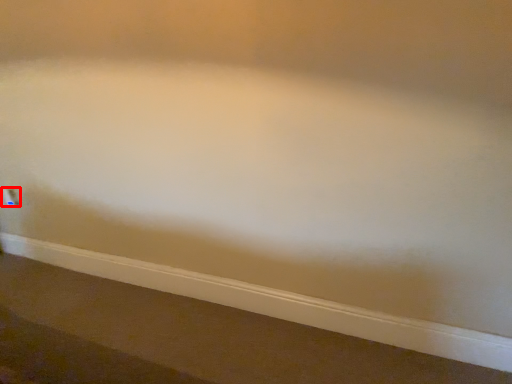
Question: From the image's perspective, considering the relative positions of electric outlet (annotated by the red box) and ledge in the image provided, where is electric outlet (annotated by the red box) located with respect to the staircase?

Choices:
 (A) below
 (B) above

Answer: (B)